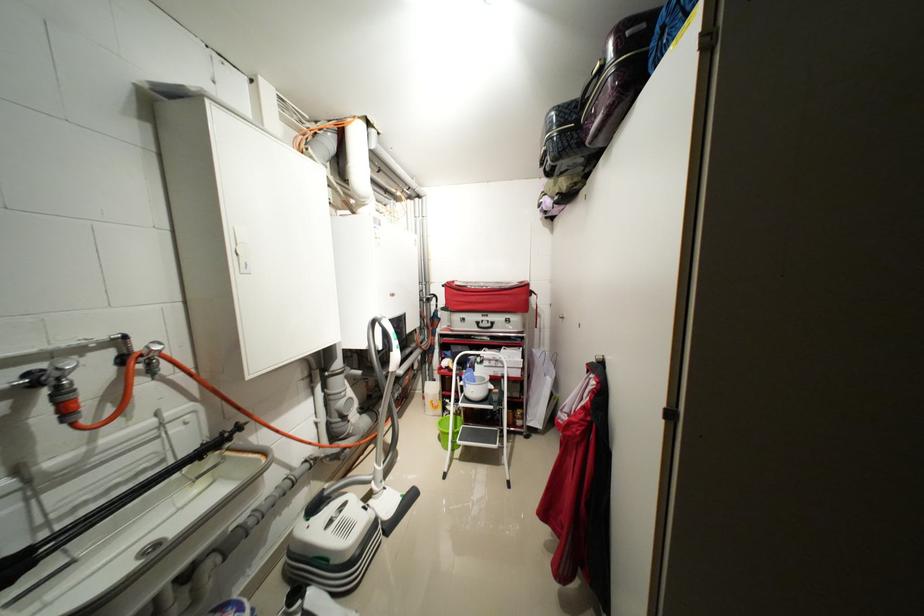
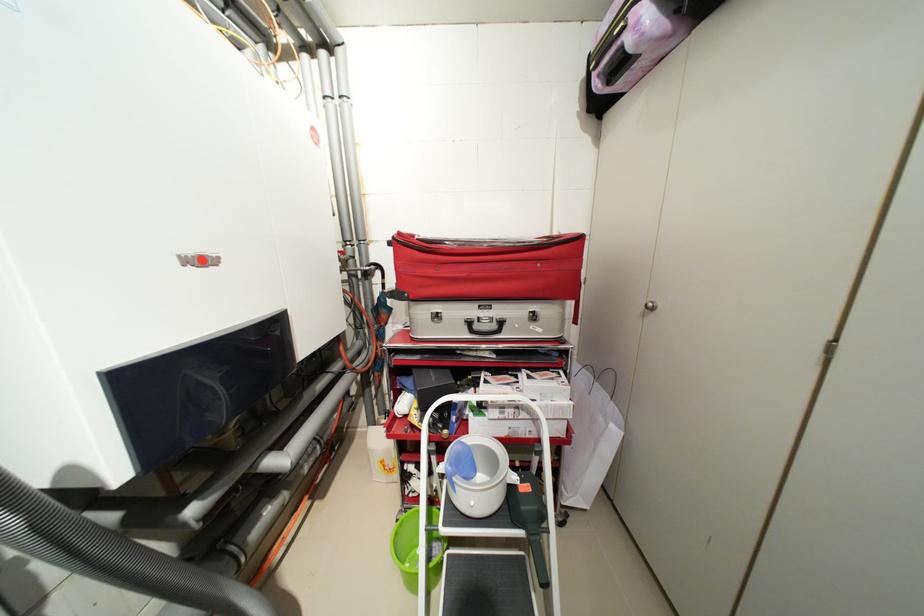
Locate, in the second image, the point that corresponds to [496,326] in the first image.

(502, 326)